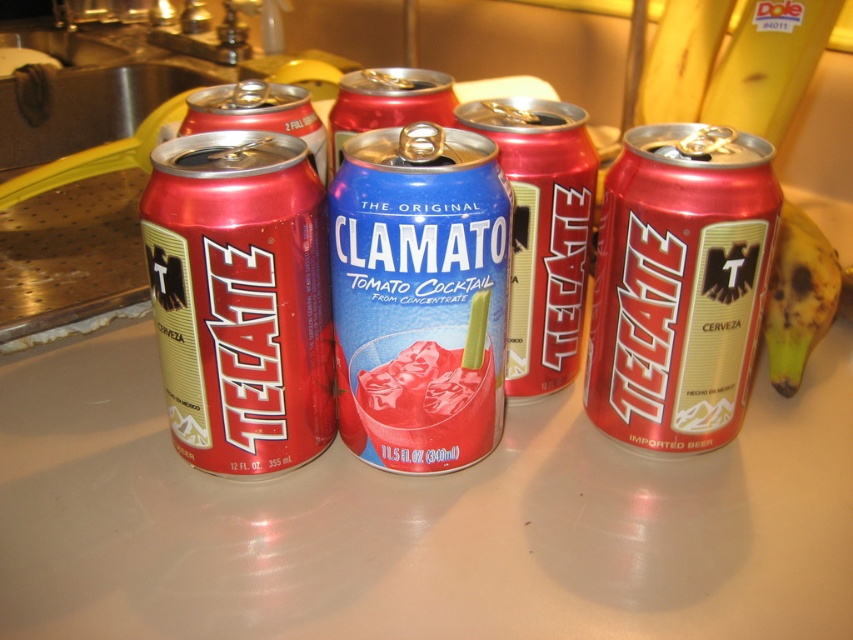
You are organizing cans on a shelf and need to know their sizes. Given that both the matte red can at left and the matte red can at center are Tecate beer cans, which one is taller?

The matte red can at left is much taller than the matte red can at center, so the one at the left is taller.